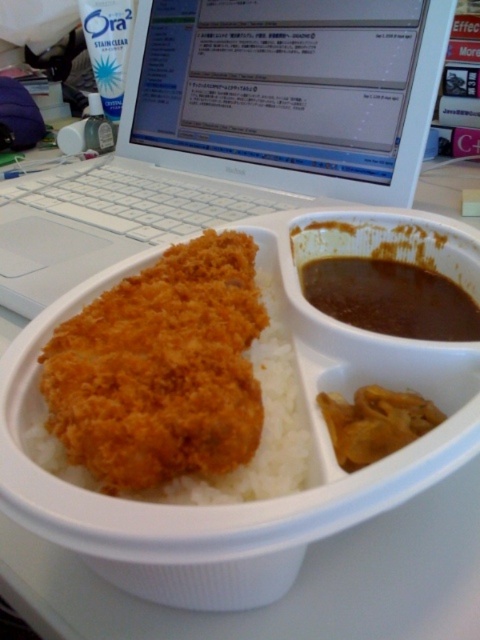
Is white plastic laptop at upper center to the left of brown crumbly curry at center from the viewer's perspective?

Indeed, white plastic laptop at upper center is positioned on the left side of brown crumbly curry at center.

Who is positioned more to the left, white plastic laptop at upper center or brown crumbly curry at center?

white plastic laptop at upper center

Is point (357, 38) positioned after point (389, 436)?

That is True.

The width and height of the screenshot is (480, 640). What are the coordinates of `white plastic laptop at upper center` in the screenshot? It's located at (233, 131).

Does point (97, 269) come farther from viewer compared to point (312, 262)?

That is True.

Does white plastic laptop at upper center have a greater width compared to brown thick gravy at lower right?

Yes.

Does point (399, 88) come farther from viewer compared to point (418, 301)?

Yes.

The height and width of the screenshot is (640, 480). Identify the location of white plastic laptop at upper center. (233, 131).

Is brown thick gravy at lower right shorter than brown crumbly curry at center?

In fact, brown thick gravy at lower right may be taller than brown crumbly curry at center.

Is brown thick gravy at lower right taller than brown crumbly curry at center?

Indeed, brown thick gravy at lower right has a greater height compared to brown crumbly curry at center.

Between point (377, 324) and point (360, 392), which one is positioned behind?

The point (377, 324) is behind.

Locate an element on the screen. The height and width of the screenshot is (640, 480). brown thick gravy at lower right is located at coordinates (391, 298).